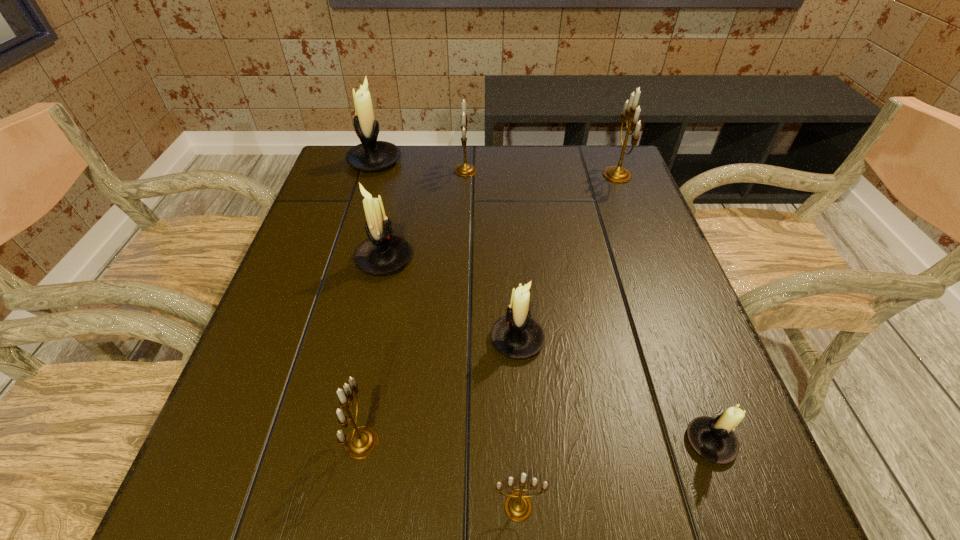
Where is `the nearest white candle holder`? Image resolution: width=960 pixels, height=540 pixels. the nearest white candle holder is located at coordinates (711, 438).

Identify the location of the smallest white candle holder. This screenshot has height=540, width=960. (711, 438).

Where is `the smallest gold candelabrum`? the smallest gold candelabrum is located at coordinates (518, 506).

Find the location of a particular element. The image size is (960, 540). the nearest object is located at coordinates (518, 506).

The height and width of the screenshot is (540, 960). What are the coordinates of `free region located 0.320m on the right of the farthest white candle holder` in the screenshot? It's located at (510, 161).

You are a GUI agent. You are given a task and a screenshot of the screen. Output one action in this format:
    pyautogui.click(x=<x>, y=<y>)
    Task: Click on the vacant space located 0.070m on the back of the rightmost gold candelabrum
    This screenshot has height=540, width=960.
    Given the screenshot: What is the action you would take?
    pyautogui.click(x=608, y=149)

At what (x,y) coordinates should I click in order to perform the action: click on vacant space located 0.230m on the right of the third nearest white candle holder. Please return your answer as a coordinate pair (x, y). Image resolution: width=960 pixels, height=540 pixels. Looking at the image, I should click on (513, 259).

Image resolution: width=960 pixels, height=540 pixels. I want to click on blank space located on the right of the fifth object from right to left, so click(603, 170).

Image resolution: width=960 pixels, height=540 pixels. What are the coordinates of `free space located 0.080m on the front of the second white candle holder from right to left` in the screenshot? It's located at (521, 402).

At what (x,y) coordinates should I click in order to perform the action: click on vacant area located on the right of the third biggest gold candelabrum. Please return your answer as a coordinate pair (x, y). The width and height of the screenshot is (960, 540). Looking at the image, I should click on (539, 442).